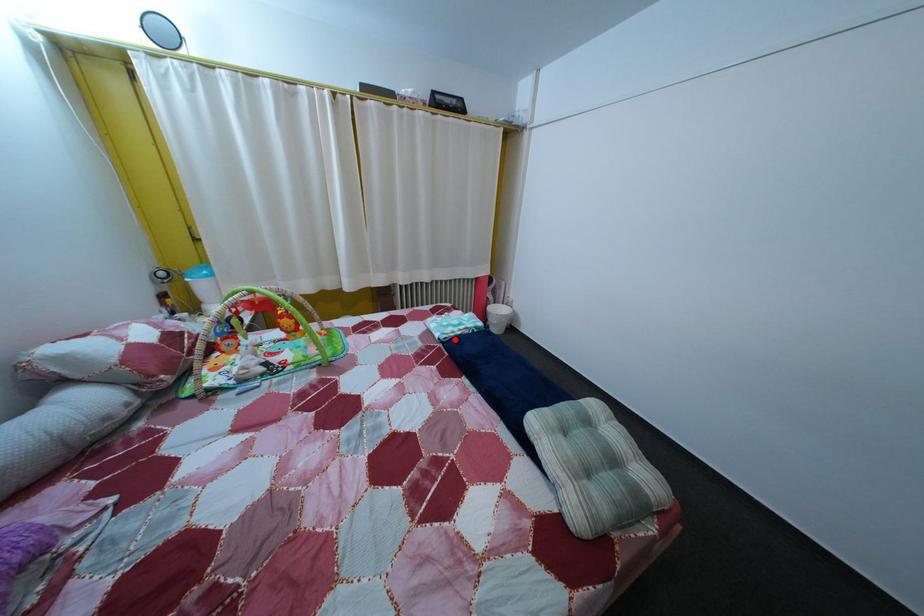
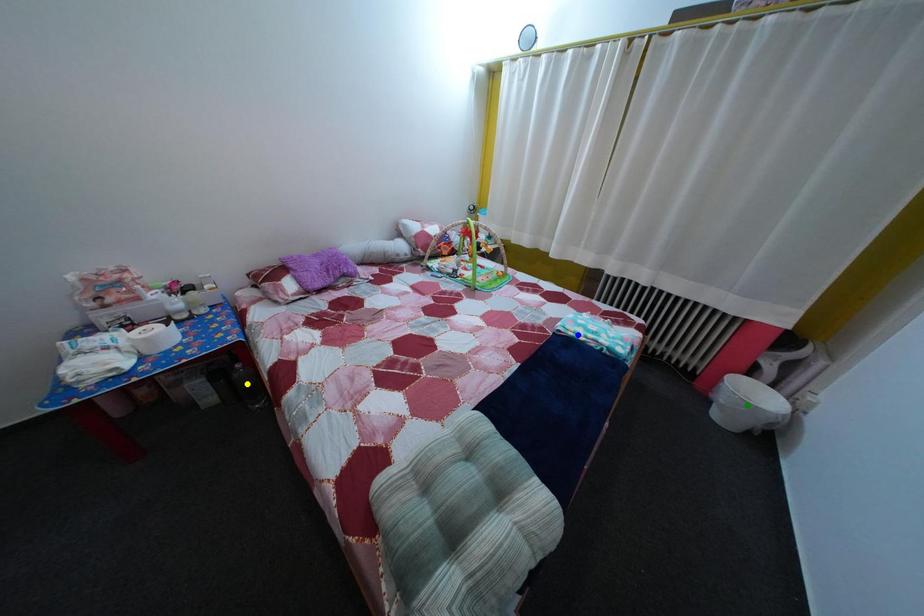
Question: I am providing you with two images of the same scene from different viewpoints. A red point is marked on the first image. You are given multiple points on the second image. In image 2, which mark is for the same physical point as the one in image 1?

Choices:
 (A) green point
 (B) blue point
 (C) yellow point

Answer: (B)